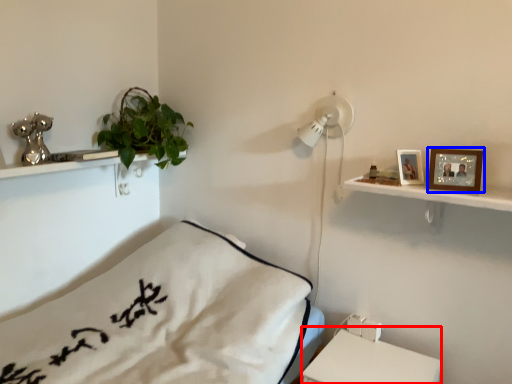
Question: Which point is further to the camera, table (highlighted by a red box) or picture frame (highlighted by a blue box)?

Choices:
 (A) table
 (B) picture frame

Answer: (B)